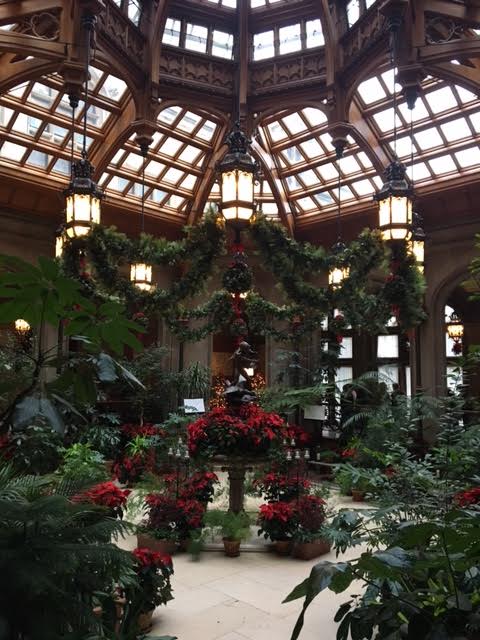
The width and height of the screenshot is (480, 640). Identify the location of glass lanterns hanging from ceiling in a circle. (400, 224), (248, 198), (77, 221), (142, 271), (342, 275), (425, 252).